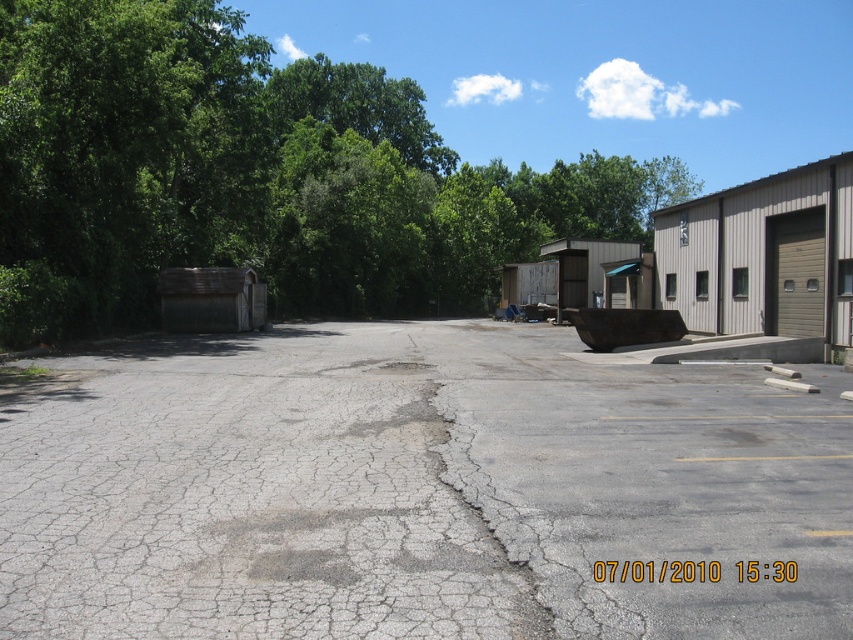
You are a construction worker assessing the site. You see the gray cracked asphalt at center and the green leafy tree at upper left. Which object is taller?

The green leafy tree at upper left is taller than the gray cracked asphalt at center.

You are a delivery driver who needs to park your vehicle between the gray cracked asphalt at center and the green leafy tree at upper left. Can you fit your vehicle there if your vehicle is 2 meters wide?

The gray cracked asphalt at center has a lesser width compared to green leafy tree at upper left. Since the gray cracked asphalt at center is narrower, it might not accommodate a 2 meter wide vehicle. Check the width of the gray cracked asphalt at center before deciding.